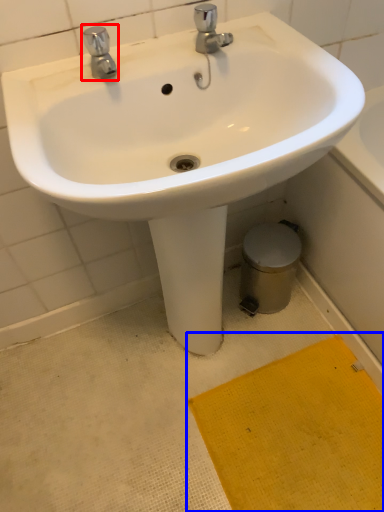
Question: Which of the following is the farthest to the observer, tap (highlighted by a red box) or doormat (highlighted by a blue box)?

Choices:
 (A) tap
 (B) doormat

Answer: (B)